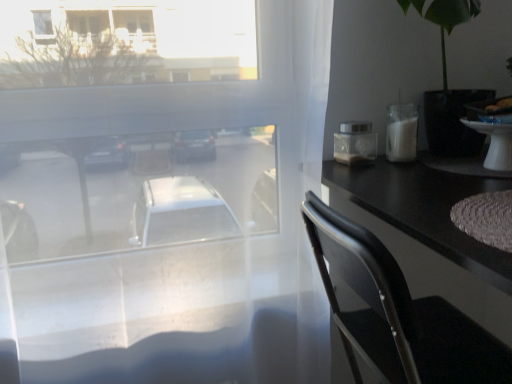
Question: Can you confirm if transparent glass window at center is smaller than black plastic chair at right?

Choices:
 (A) no
 (B) yes

Answer: (A)

Question: Considering the relative sizes of transparent glass window at center and black plastic chair at right in the image provided, is transparent glass window at center shorter than black plastic chair at right?

Choices:
 (A) yes
 (B) no

Answer: (B)

Question: From the image's perspective, does transparent glass window at center appear lower than black plastic chair at right?

Choices:
 (A) no
 (B) yes

Answer: (A)

Question: Considering the relative sizes of transparent glass window at center and black plastic chair at right in the image provided, is transparent glass window at center taller than black plastic chair at right?

Choices:
 (A) yes
 (B) no

Answer: (A)

Question: Does transparent glass window at center lie behind black plastic chair at right?

Choices:
 (A) yes
 (B) no

Answer: (A)

Question: Based on their positions, is transparent glass window at center located to the left or right of white glossy table at right?

Choices:
 (A) left
 (B) right

Answer: (A)

Question: Is transparent glass window at center in front of or behind white glossy table at right in the image?

Choices:
 (A) behind
 (B) front

Answer: (B)

Question: In terms of height, does transparent glass window at center look taller or shorter compared to white glossy table at right?

Choices:
 (A) short
 (B) tall

Answer: (B)

Question: From a real-world perspective, relative to white glossy table at right, is transparent glass window at center vertically above or below?

Choices:
 (A) above
 (B) below

Answer: (B)

Question: Is transparent glass window at center to the left or to the right of black plastic chair at right in the image?

Choices:
 (A) left
 (B) right

Answer: (A)

Question: In terms of height, does transparent glass window at center look taller or shorter compared to black plastic chair at right?

Choices:
 (A) tall
 (B) short

Answer: (A)

Question: Looking at the image, does transparent glass window at center seem bigger or smaller compared to black plastic chair at right?

Choices:
 (A) small
 (B) big

Answer: (B)

Question: Considering their positions, is transparent glass window at center located in front of or behind black plastic chair at right?

Choices:
 (A) behind
 (B) front

Answer: (A)

Question: Considering the positions of white glossy table at right and black plastic chair at right in the image, is white glossy table at right bigger or smaller than black plastic chair at right?

Choices:
 (A) small
 (B) big

Answer: (A)

Question: From their relative heights in the image, would you say white glossy table at right is taller or shorter than black plastic chair at right?

Choices:
 (A) tall
 (B) short

Answer: (B)